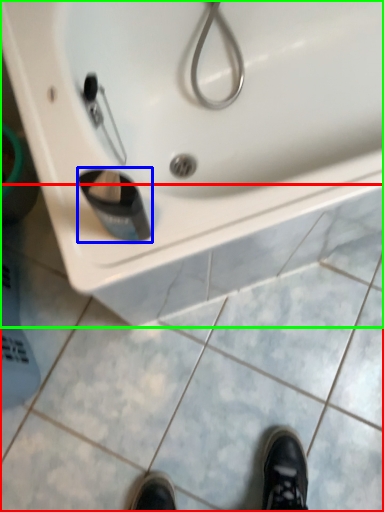
Question: Estimate the real-world distances between objects in this image. Which object is farther from tile (highlighted by a red box), liquid (highlighted by a blue box) or sink (highlighted by a green box)?

Choices:
 (A) liquid
 (B) sink

Answer: (A)